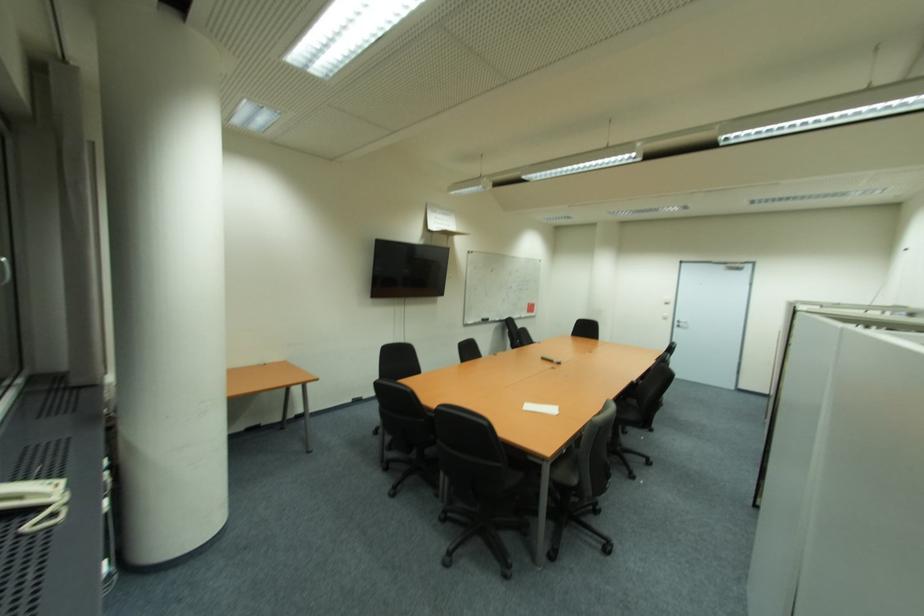
This screenshot has width=924, height=616. Identify the location of silver door handle. (681, 323).